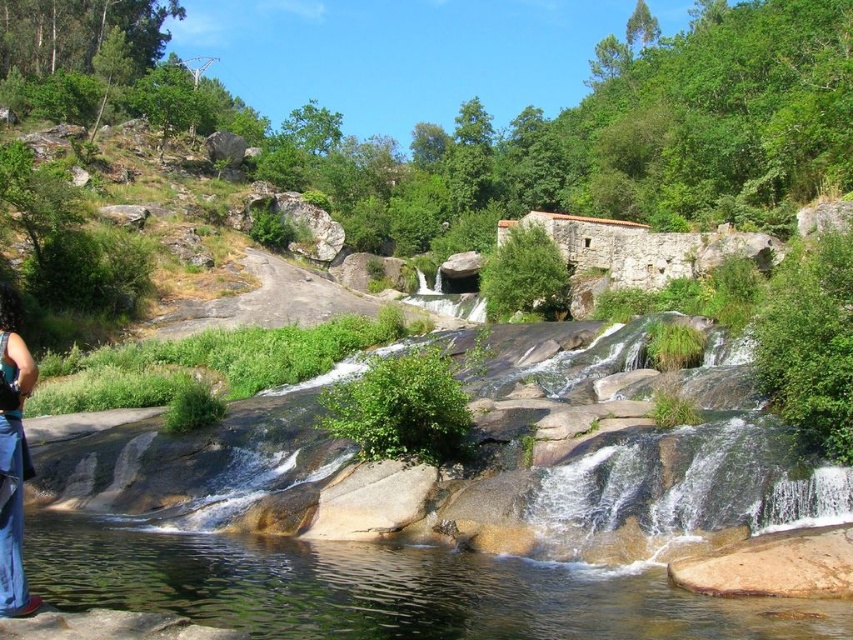
Question: Is clear water at lower left smaller than blue denim dress at lower left?

Choices:
 (A) yes
 (B) no

Answer: (A)

Question: Which object is farther from the camera taking this photo?

Choices:
 (A) blue denim dress at lower left
 (B) clear water at lower left

Answer: (B)

Question: Is clear water at lower left positioned at the back of blue denim dress at lower left?

Choices:
 (A) no
 (B) yes

Answer: (B)

Question: Is clear water at lower left above blue denim dress at lower left?

Choices:
 (A) yes
 (B) no

Answer: (B)

Question: Which object is closer to the camera taking this photo?

Choices:
 (A) blue denim dress at lower left
 (B) clear water at lower left

Answer: (A)